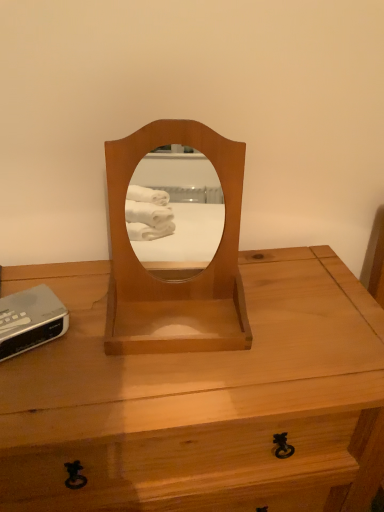
I want to click on free space behind silver plastic clock at lower left, so click(56, 280).